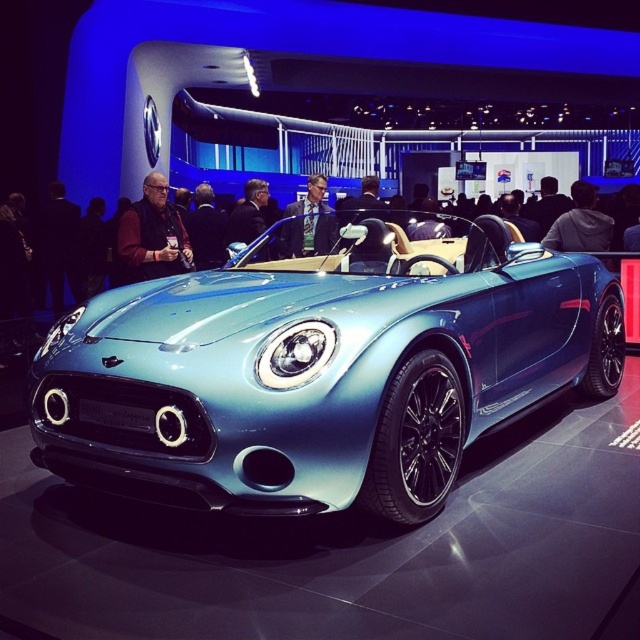
You are at an auto show and see the metallic blue sports car at center and the light blue fabric suit at center. Which object is positioned to the right side of the other?

The metallic blue sports car at center is to the right of the light blue fabric suit at center.

You are standing at the entrance of the exhibition hall and see the metallic blue sports car at center. If you want to walk directly towards it, which direction should you move from your current position?

Since the metallic blue sports car at center is located at point coordinates, you should move straight ahead from the entrance to reach it directly.